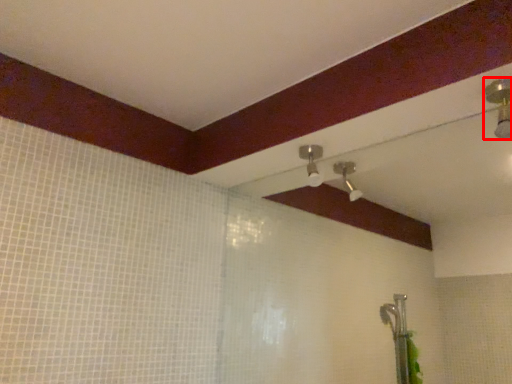
Question: From the image's perspective, where is shower (annotated by the red box) located in relation to shower in the image?

Choices:
 (A) below
 (B) above

Answer: (B)